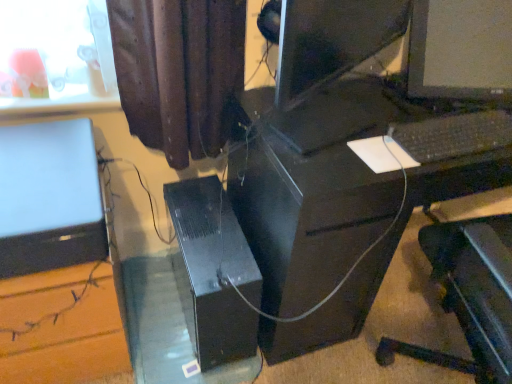
Question: Considering the positions of black plastic keyboard at center and black plastic computer desk at center in the image, is black plastic keyboard at center bigger or smaller than black plastic computer desk at center?

Choices:
 (A) big
 (B) small

Answer: (B)

Question: Visually, is black plastic keyboard at center positioned to the left or to the right of black plastic computer desk at center?

Choices:
 (A) left
 (B) right

Answer: (B)

Question: Which of these objects is positioned farthest from the satin silver laptop at left?

Choices:
 (A) black plastic computer tower at center
 (B) black plastic computer desk at center
 (C) black plastic keyboard at center

Answer: (C)

Question: Considering the real-world distances, which object is farthest from the black plastic computer tower at center?

Choices:
 (A) black plastic keyboard at center
 (B) black plastic computer desk at center
 (C) satin silver laptop at left

Answer: (A)